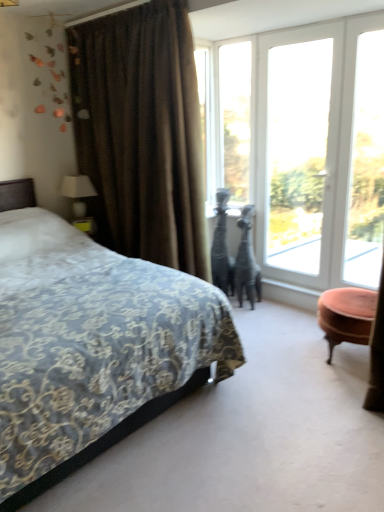
Locate an element on the screen. This screenshot has height=512, width=384. free space in front of velvet pink ottoman at right is located at coordinates (337, 388).